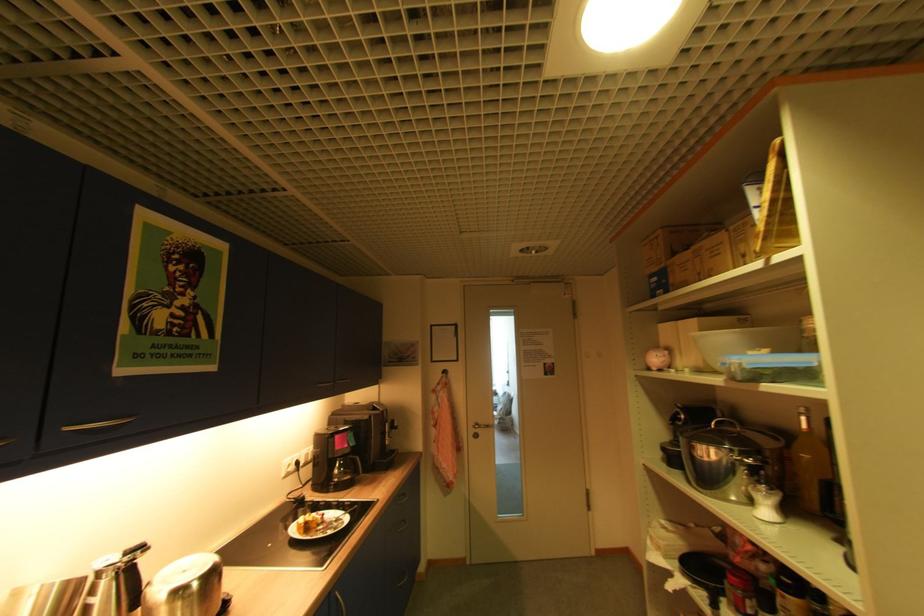
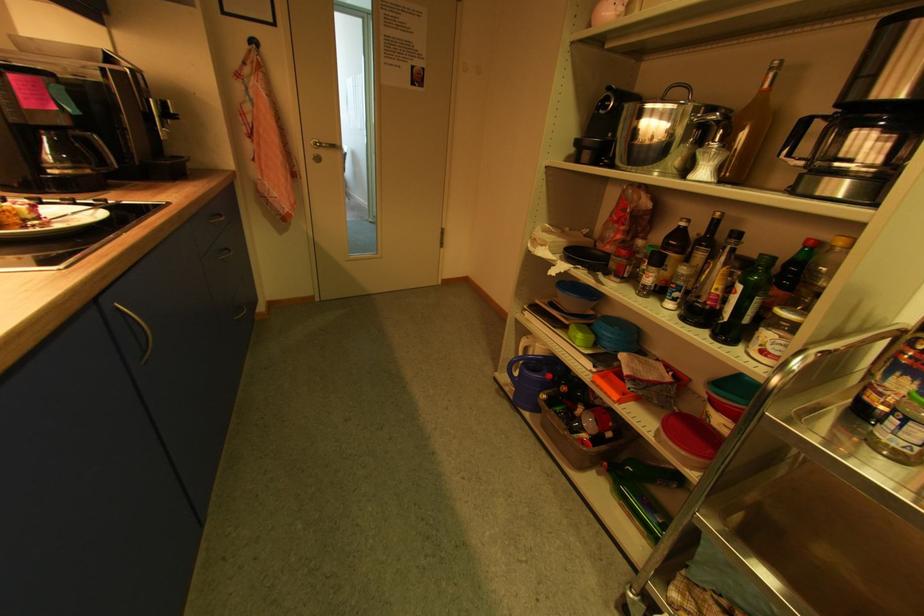
Locate, in the second image, the point that corresponds to (x=772, y=513) in the first image.

(709, 175)